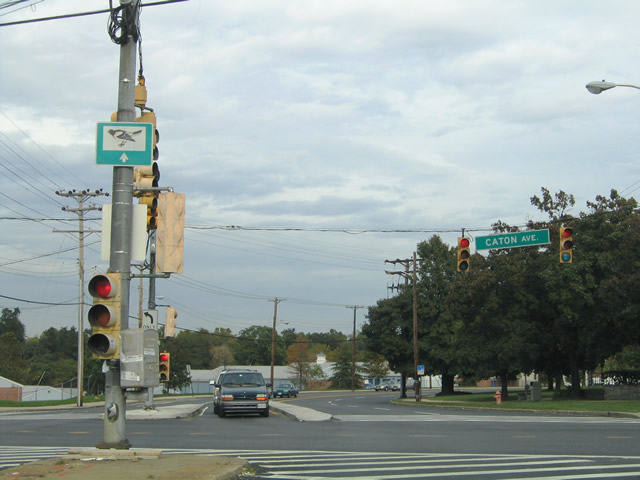
Where is `light bulb`? This screenshot has height=480, width=640. light bulb is located at coordinates (594, 91).